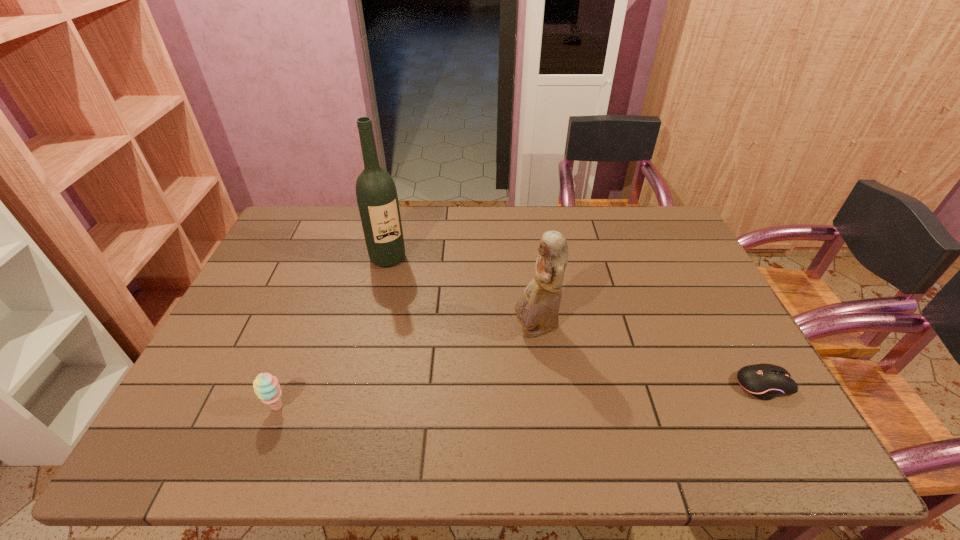
The width and height of the screenshot is (960, 540). Find the location of `free space on the desktop that is between the leftmost object and the shortest object and is positioned on the front-facing side of the figurine`. free space on the desktop that is between the leftmost object and the shortest object and is positioned on the front-facing side of the figurine is located at coordinates (462, 399).

Where is `vacant space on the desktop that is between the sherbert and the shortest object and is positioned on the labeled side of the farthest object`? Image resolution: width=960 pixels, height=540 pixels. vacant space on the desktop that is between the sherbert and the shortest object and is positioned on the labeled side of the farthest object is located at coordinates (478, 397).